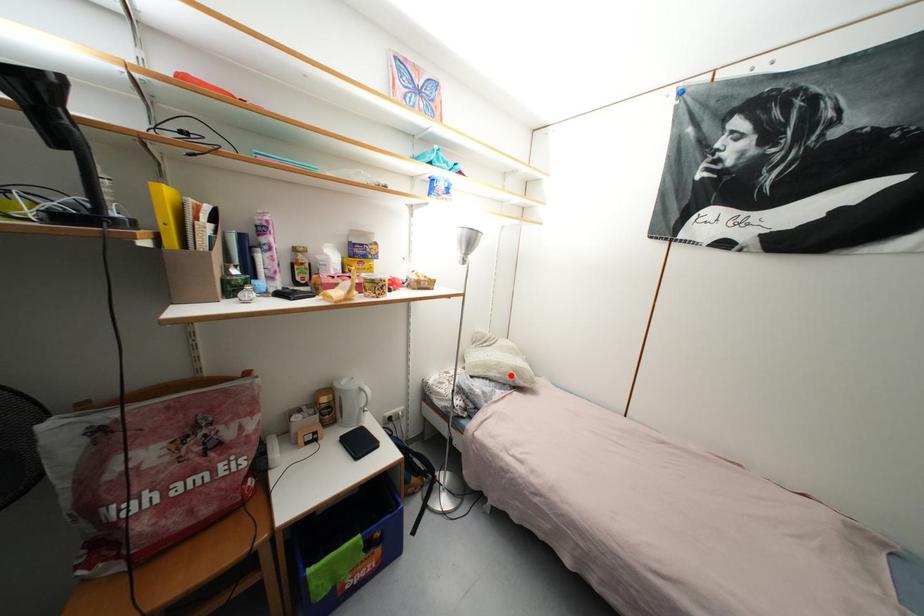
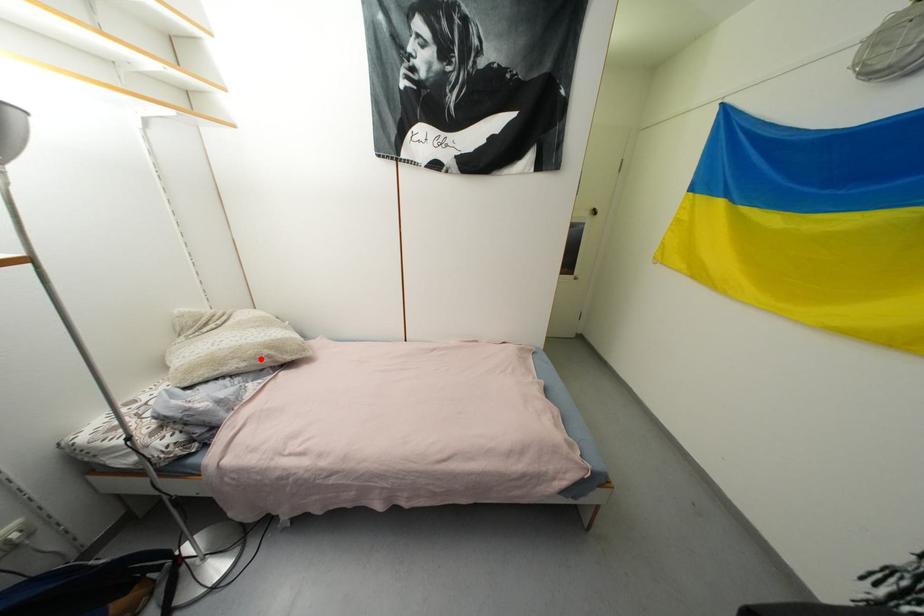
I am providing you with two images of the same scene from different viewpoints. A red point is marked on the first image and another point is marked on the second image. Are the points marked in image1 and image2 representing the same 3D position?

Yes